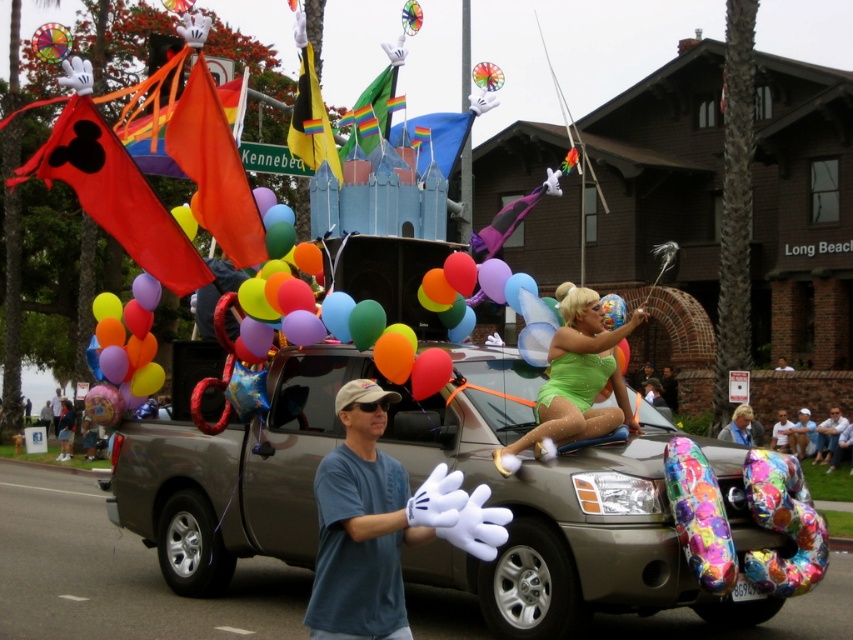
Question: Is white fabric gloves at center bigger than rainbow fabric flag at center?

Choices:
 (A) yes
 (B) no

Answer: (B)

Question: Is white fabric gloves at center below orange fabric flag at upper center?

Choices:
 (A) yes
 (B) no

Answer: (A)

Question: Does white fabric gloves at center appear on the right side of red fabric flag at upper left?

Choices:
 (A) no
 (B) yes

Answer: (B)

Question: Which of the following is the farthest from the observer?

Choices:
 (A) orange fabric flag at upper center
 (B) light blue t-shirt at center

Answer: (B)

Question: Which object is positioned farthest from the multicolored glossy balloons at center?

Choices:
 (A) green satin dress at center
 (B) blue fabric flag at center
 (C) green matte surfboard at center

Answer: (B)

Question: Which point is closer to the camera taking this photo?

Choices:
 (A) (341, 154)
 (B) (746, 403)
 (C) (398, 129)

Answer: (A)